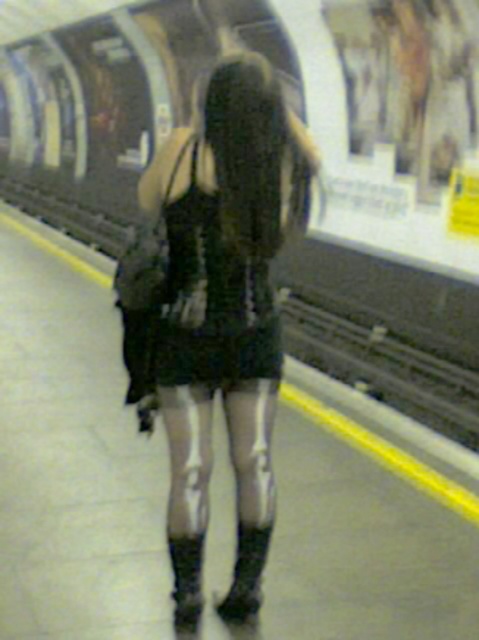
Is black mesh dress at center further to the viewer compared to black matte dress at center?

That is False.

Measure the distance between black mesh dress at center and camera.

2.98 meters

Is point (184, 378) farther from viewer compared to point (216, 280)?

Yes, it is.

Identify the location of black mesh dress at center. (215, 284).

Is leather boots at lower center below leather boots at center?

No, leather boots at lower center is not below leather boots at center.

Is leather boots at lower center wider than leather boots at center?

Indeed, leather boots at lower center has a greater width compared to leather boots at center.

Is point (242, 563) positioned in front of point (183, 573)?

That is False.

Where is `leather boots at lower center`? Image resolution: width=479 pixels, height=640 pixels. leather boots at lower center is located at coordinates (246, 573).

Which is in front, point (238, 346) or point (240, 577)?

Point (238, 346)

Which is below, black matte dress at center or leather boots at lower center?

leather boots at lower center is lower down.

Does point (254, 324) come closer to viewer compared to point (243, 608)?

Yes, point (254, 324) is closer to viewer.

At what (x,y) coordinates should I click in order to perform the action: click on black matte dress at center. Please return your answer as a coordinate pair (x, y). This screenshot has width=479, height=640. Looking at the image, I should click on (213, 301).